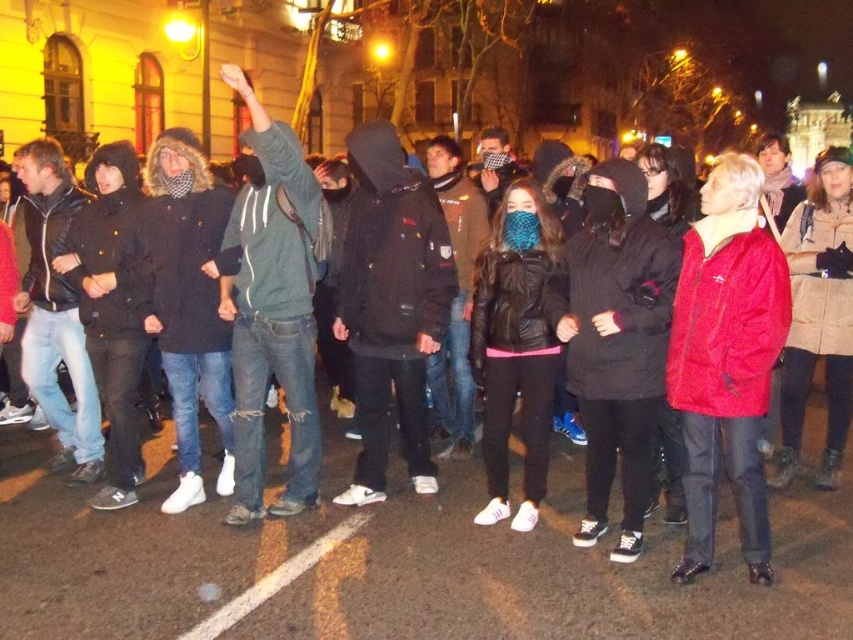
Question: Considering the relative positions of velvet red jacket at center and ripped denim jeans at center in the image provided, where is velvet red jacket at center located with respect to ripped denim jeans at center?

Choices:
 (A) left
 (B) right

Answer: (B)

Question: Is velvet red jacket at center below ripped denim jeans at center?

Choices:
 (A) no
 (B) yes

Answer: (B)

Question: Does velvet red jacket at center appear over ripped denim jeans at center?

Choices:
 (A) no
 (B) yes

Answer: (A)

Question: Which of the following is the closest to the observer?

Choices:
 (A) click(735, 385)
 (B) click(248, 83)

Answer: (A)

Question: Which point appears closest to the camera in this image?

Choices:
 (A) (299, 147)
 (B) (755, 576)

Answer: (B)

Question: Which object appears closest to the camera in this image?

Choices:
 (A) velvet red jacket at center
 (B) ripped denim jeans at center

Answer: (A)